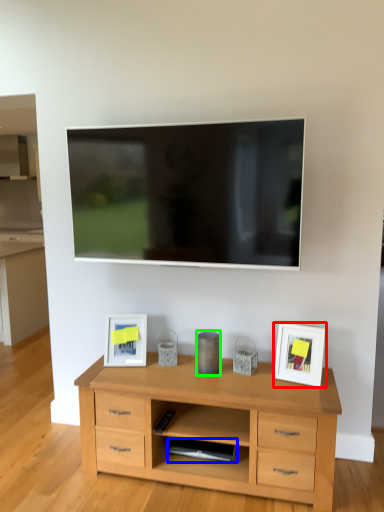
Question: Estimate the real-world distances between objects in this image. Which object is farther from picture frame (highlighted by a red box), appliance (highlighted by a blue box) or appliance (highlighted by a green box)?

Choices:
 (A) appliance
 (B) appliance

Answer: (A)